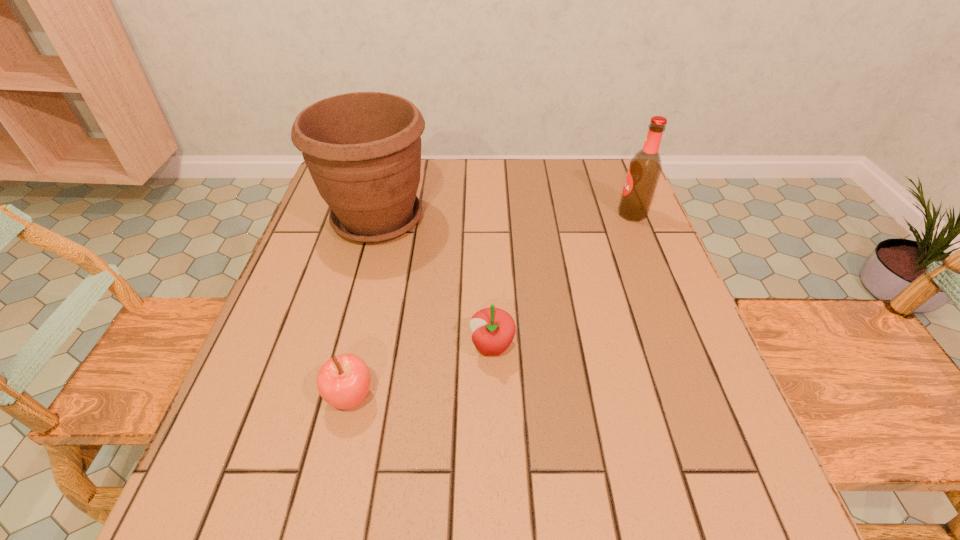
In order to click on object that stands as the third closest to the flowerpot in this screenshot , I will do `click(645, 167)`.

What are the coordinates of `object that is the third nearest to the beer bottle` in the screenshot? It's located at (343, 381).

I want to click on free space in the image that satisfies the following two spatial constraints: 1. on the back side of the beer bottle; 2. on the right side of the flowerpot, so click(379, 213).

The height and width of the screenshot is (540, 960). Find the location of `vacant point that satisfies the following two spatial constraints: 1. on the back side of the third object from left to right; 2. on the left side of the left apple`. vacant point that satisfies the following two spatial constraints: 1. on the back side of the third object from left to right; 2. on the left side of the left apple is located at coordinates (362, 347).

The image size is (960, 540). I want to click on vacant space that satisfies the following two spatial constraints: 1. on the back side of the third object from left to right; 2. on the right side of the beer bottle, so click(489, 213).

This screenshot has height=540, width=960. In order to click on free space that satisfies the following two spatial constraints: 1. on the front side of the nearer apple; 2. on the right side of the flowerpot in this screenshot , I will do `click(330, 397)`.